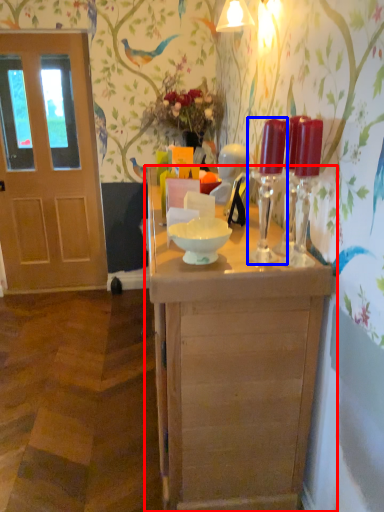
Question: Which object is closer to the camera taking this photo, table (highlighted by a red box) or candle holder (highlighted by a blue box)?

Choices:
 (A) table
 (B) candle holder

Answer: (A)